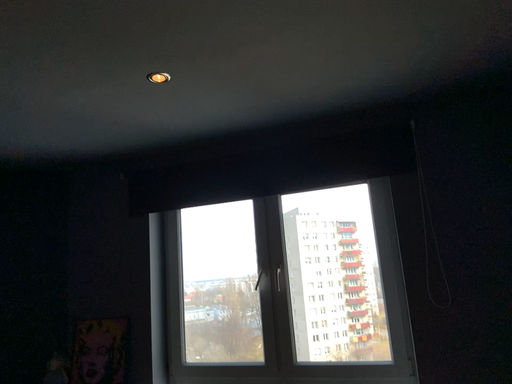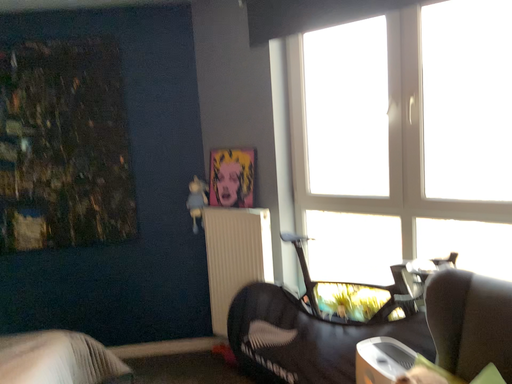
Question: Which way did the camera rotate in the video?

Choices:
 (A) rotated downward
 (B) rotated upward

Answer: (A)